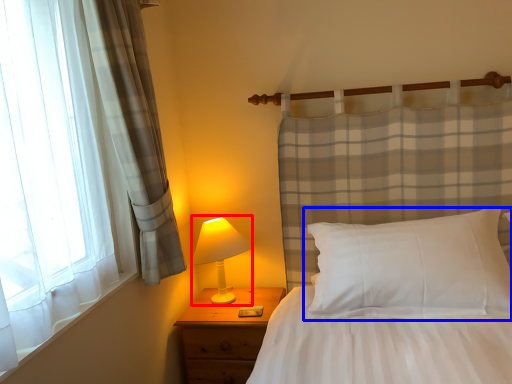
Question: Among these objects, which one is farthest to the camera, table lamp (highlighted by a red box) or pillow (highlighted by a blue box)?

Choices:
 (A) table lamp
 (B) pillow

Answer: (A)